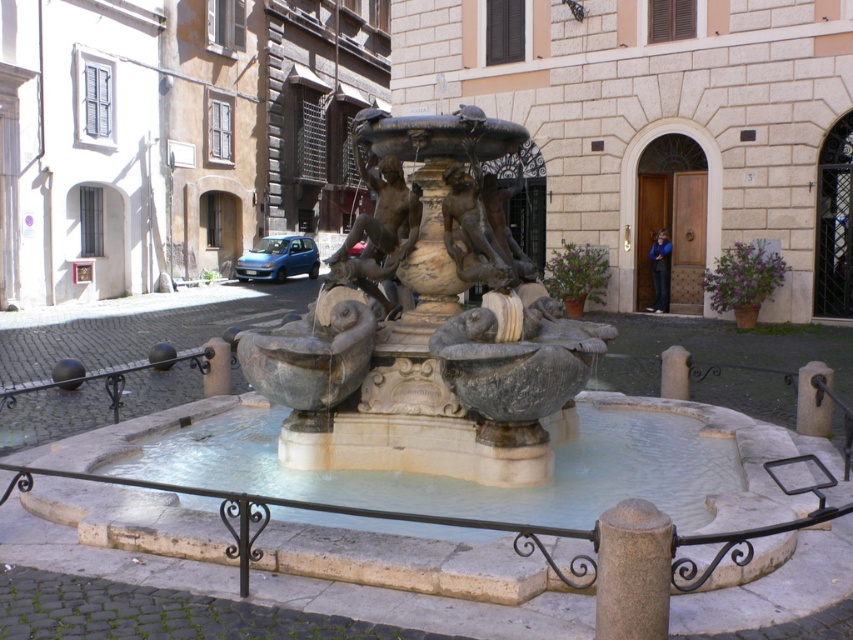
Question: Which of the following is the farthest from the observer?

Choices:
 (A) granite post at lower center
 (B) gray stone pillar at center

Answer: (B)

Question: Can you confirm if granite post at lower center is positioned to the right of gray stone pillar at center?

Choices:
 (A) yes
 (B) no

Answer: (B)

Question: Does bronze statue at center have a lesser width compared to gray stone pillar at center?

Choices:
 (A) no
 (B) yes

Answer: (A)

Question: Which object is positioned closest to the bronze statue at center?

Choices:
 (A) gray stone pillar at center
 (B) granite post at lower center

Answer: (B)

Question: Can you confirm if bronze statue at center is thinner than gray stone pillar at center?

Choices:
 (A) yes
 (B) no

Answer: (B)

Question: Which object is closer to the camera taking this photo?

Choices:
 (A) gray stone pillar at center
 (B) bronze statue at center
 (C) granite post at lower center

Answer: (C)